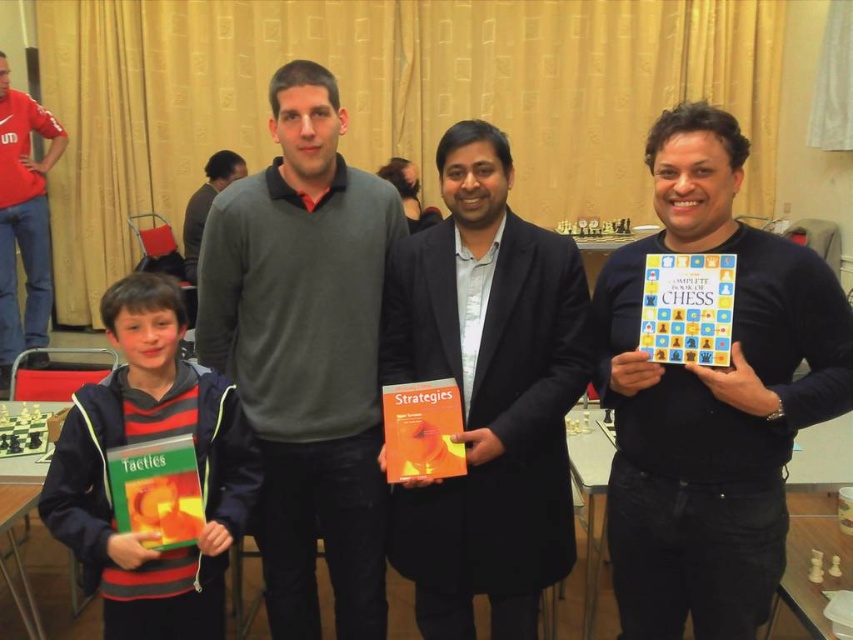
Consider the image. You are organizing a chess tournament and need to place a name tag on the striped fabric jacket at lower left and the hardcover book at center. Which item requires a larger name tag?

The striped fabric jacket at lower left requires a larger name tag because it has a larger size compared to the hardcover book at center.